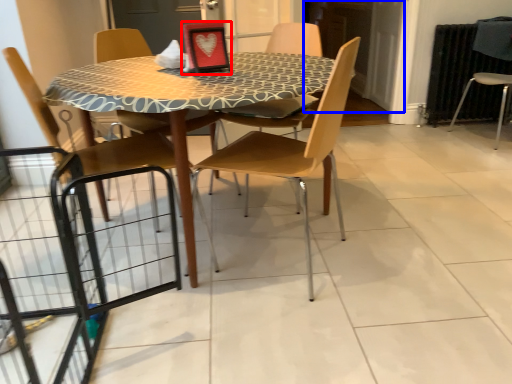
Question: Which point is closer to the camera, picture frame (highlighted by a red box) or screen door (highlighted by a blue box)?

Choices:
 (A) picture frame
 (B) screen door

Answer: (A)